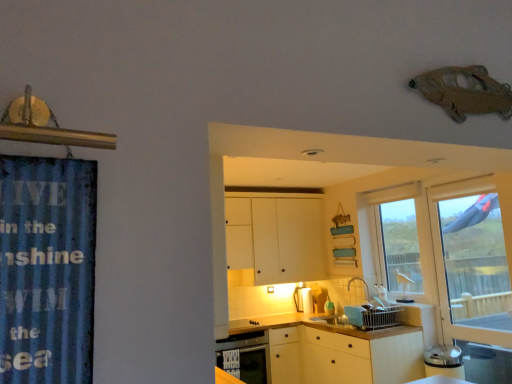
Question: Should I look upward or downward to see white plastic dish rack at lower center, the third appliance viewed from the left?

Choices:
 (A) down
 (B) up

Answer: (A)

Question: Does matte white dishwasher at lower center turn towards transparent glass door at right?

Choices:
 (A) no
 (B) yes

Answer: (A)

Question: Does matte white dishwasher at lower center have a greater height compared to transparent glass door at right?

Choices:
 (A) yes
 (B) no

Answer: (B)

Question: Is matte white dishwasher at lower center looking in the opposite direction of transparent glass door at right?

Choices:
 (A) no
 (B) yes

Answer: (A)

Question: Considering the relative sizes of matte white dishwasher at lower center and transparent glass door at right in the image provided, is matte white dishwasher at lower center smaller than transparent glass door at right?

Choices:
 (A) yes
 (B) no

Answer: (B)

Question: Would you say matte white dishwasher at lower center is outside transparent glass door at right?

Choices:
 (A) yes
 (B) no

Answer: (A)

Question: Does matte white dishwasher at lower center lie in front of transparent glass door at right?

Choices:
 (A) no
 (B) yes

Answer: (A)

Question: Is transparent glass door at right positioned before blue corrugated metal at left?

Choices:
 (A) yes
 (B) no

Answer: (B)

Question: From the image's perspective, is transparent glass door at right below blue corrugated metal at left?

Choices:
 (A) no
 (B) yes

Answer: (B)

Question: Does transparent glass door at right have a lesser height compared to blue corrugated metal at left?

Choices:
 (A) no
 (B) yes

Answer: (A)

Question: Is transparent glass door at right to the left of blue corrugated metal at left from the viewer's perspective?

Choices:
 (A) no
 (B) yes

Answer: (A)

Question: Does transparent glass door at right appear on the right side of blue corrugated metal at left?

Choices:
 (A) yes
 (B) no

Answer: (A)

Question: Considering the relative sizes of transparent glass door at right and blue corrugated metal at left in the image provided, is transparent glass door at right smaller than blue corrugated metal at left?

Choices:
 (A) yes
 (B) no

Answer: (B)

Question: Is matte white dishwasher at lower center touching blue corrugated metal at left?

Choices:
 (A) yes
 (B) no

Answer: (B)